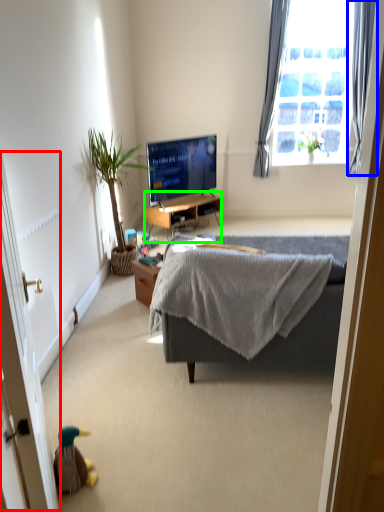
Question: Which is farther away from screen door (highlighted by a red box)? curtain (highlighted by a blue box) or desk (highlighted by a green box)?

Choices:
 (A) curtain
 (B) desk

Answer: (A)